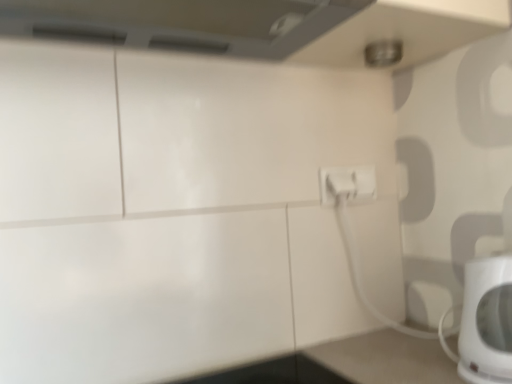
Question: Are white plastic electric outlet at center-right and white glossy electric kettle at lower right making contact?

Choices:
 (A) no
 (B) yes

Answer: (A)

Question: Does white plastic electric outlet at center-right lie behind white glossy electric kettle at lower right?

Choices:
 (A) no
 (B) yes

Answer: (B)

Question: Can you confirm if white plastic electric outlet at center-right is wider than white glossy electric kettle at lower right?

Choices:
 (A) yes
 (B) no

Answer: (B)

Question: Does white plastic electric outlet at center-right contain white glossy electric kettle at lower right?

Choices:
 (A) yes
 (B) no

Answer: (B)

Question: Is white plastic electric outlet at center-right bigger than white glossy electric kettle at lower right?

Choices:
 (A) no
 (B) yes

Answer: (A)

Question: Is white plastic electric outlet at center-right not within white glossy electric kettle at lower right?

Choices:
 (A) no
 (B) yes

Answer: (B)

Question: Is white glossy electric kettle at lower right bigger than white plastic electric outlet at center-right?

Choices:
 (A) yes
 (B) no

Answer: (A)

Question: Is the depth of white glossy electric kettle at lower right greater than that of white plastic electric outlet at center-right?

Choices:
 (A) no
 (B) yes

Answer: (A)

Question: Are white glossy electric kettle at lower right and white plastic electric outlet at center-right far apart?

Choices:
 (A) no
 (B) yes

Answer: (A)

Question: Is white glossy electric kettle at lower right wider than white plastic electric outlet at center-right?

Choices:
 (A) no
 (B) yes

Answer: (B)

Question: Considering the relative positions of white glossy electric kettle at lower right and white plastic electric outlet at center-right in the image provided, is white glossy electric kettle at lower right to the left of white plastic electric outlet at center-right from the viewer's perspective?

Choices:
 (A) no
 (B) yes

Answer: (A)

Question: Is white glossy electric kettle at lower right shorter than white plastic electric outlet at center-right?

Choices:
 (A) yes
 (B) no

Answer: (B)

Question: From a real-world perspective, is white plastic electric outlet at center-right physically located above or below white glossy electric kettle at lower right?

Choices:
 (A) below
 (B) above

Answer: (B)